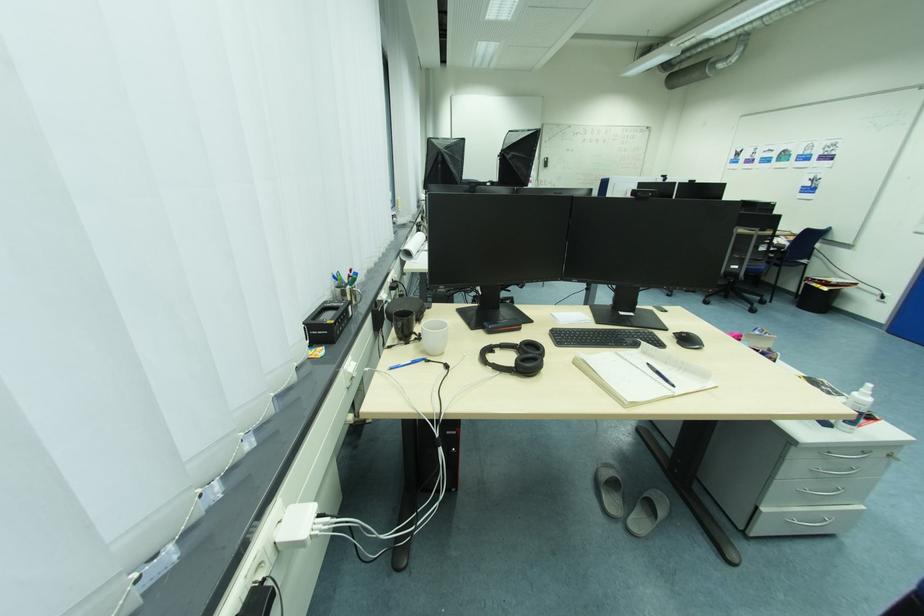
Image resolution: width=924 pixels, height=616 pixels. Identify the location of black pen. (407, 363).